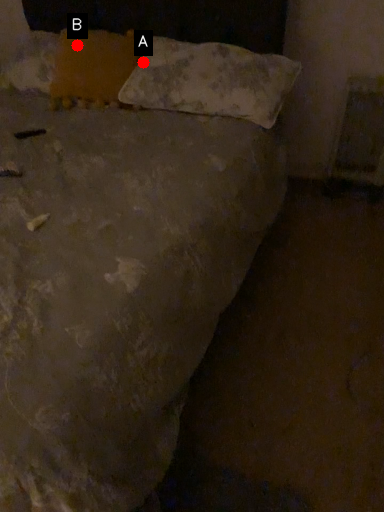
Question: Two points are circled on the image, labeled by A and B beside each circle. Among these points, which one is nearest to the camera?

Choices:
 (A) A is closer
 (B) B is closer

Answer: (B)